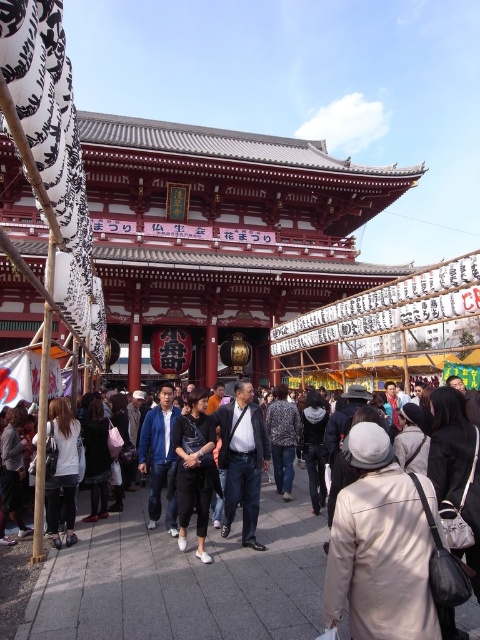
You are standing at the camera position and want to reach the point marked as point (95, 477). If your walking speed is 1.5 meters per second, how many seconds will it take you to reach that point?

The distance between you and point (95, 477) is 37.33 meters. At a speed of 1.5 meters per second, it will take approximately 24.89 seconds to reach the point.

You are a photographer standing in the crowd at the festival. You see the white matte jacket at center and the denim jacket at lower left. Which jacket is more to the right in the scene?

The white matte jacket at center is more to the right because it is positioned on the right side of the denim jacket at lower left.

You are a photographer at the festival and want to capture a photo of the dark blue jeans at center and the patterned fabric coat at center. To ensure both are fully visible in the frame, which object should you focus on first to account for their sizes?

The dark blue jeans at center has a larger width than the patterned fabric coat at center, so you should focus on the dark blue jeans at center first to ensure it fits properly in the frame.